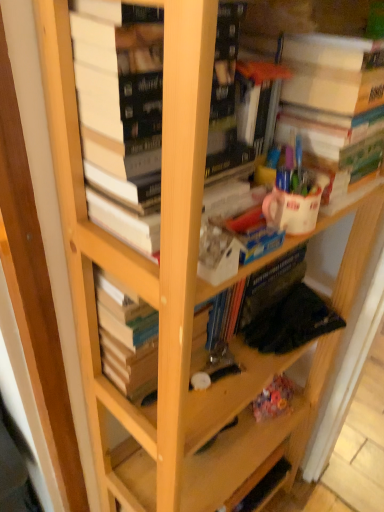
Question: Is white glossy coffee cup at upper center inside the boundaries of white matte paper at upper right, acting as the first book starting from the right, or outside?

Choices:
 (A) outside
 (B) inside

Answer: (A)

Question: From the image's perspective, is white glossy coffee cup at upper center positioned above or below white matte paper at upper right, marked as the third book in a left-to-right arrangement?

Choices:
 (A) below
 (B) above

Answer: (A)

Question: Which of these objects is positioned closest to the white glossy coffee cup at upper center?

Choices:
 (A) hardcover book at center, which ranks as the 3th book in right-to-left order
 (B) hardcover books at center, marked as the second book in a left-to-right arrangement
 (C) white matte paper at upper right, marked as the third book in a left-to-right arrangement

Answer: (C)

Question: Estimate the real-world distances between objects in this image. Which object is closer to the hardcover book at center, positioned as the 1th book in left-to-right order?

Choices:
 (A) white glossy coffee cup at upper center
 (B) white matte paper at upper right, acting as the first book starting from the right
 (C) hardcover books at center, marked as the second book in a right-to-left arrangement

Answer: (C)